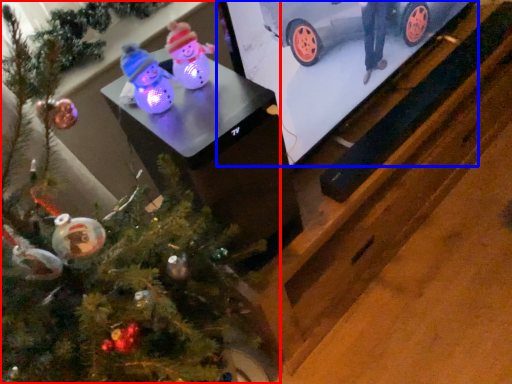
Question: Which point is closer to the camera, christmas tree (highlighted by a red box) or tv show (highlighted by a blue box)?

Choices:
 (A) christmas tree
 (B) tv show

Answer: (A)